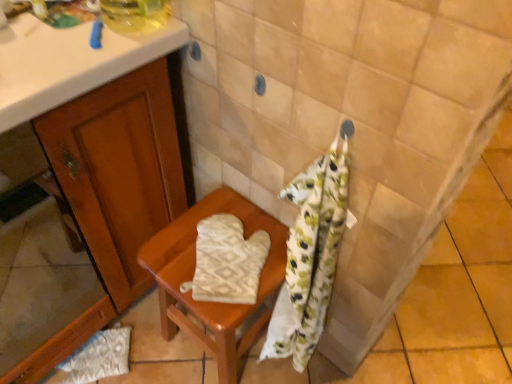
What do you see at coordinates (192, 276) in the screenshot?
I see `beige fabric oven mitt at center` at bounding box center [192, 276].

Locate an element on the screen. The width and height of the screenshot is (512, 384). white textured oven mitt at lower left is located at coordinates (99, 357).

The width and height of the screenshot is (512, 384). I want to click on beige textured oven mitt at center, so click(x=227, y=261).

The image size is (512, 384). What do you see at coordinates (227, 261) in the screenshot? I see `beige textured oven mitt at center` at bounding box center [227, 261].

Where is `beige fabric oven mitt at center`? beige fabric oven mitt at center is located at coordinates (192, 276).

Is white textured oven mitt at lower left not near beige textured oven mitt at center?

No, white textured oven mitt at lower left is in close proximity to beige textured oven mitt at center.

Is white textured oven mitt at lower left situated inside beige textured oven mitt at center or outside?

white textured oven mitt at lower left is spatially situated outside beige textured oven mitt at center.

Considering the sizes of white textured oven mitt at lower left and beige textured oven mitt at center in the image, is white textured oven mitt at lower left taller or shorter than beige textured oven mitt at center?

Considering their sizes, white textured oven mitt at lower left has less height than beige textured oven mitt at center.

Is beige textured oven mitt at center oriented towards beige fabric oven mitt at center?

No.

Does point (252, 289) come closer to viewer compared to point (197, 328)?

That is True.

From the picture: Is beige textured oven mitt at center outside of beige fabric oven mitt at center?

Absolutely, beige textured oven mitt at center is external to beige fabric oven mitt at center.

What's the angular difference between beige textured oven mitt at center and beige fabric oven mitt at center's facing directions?

The angular difference between beige textured oven mitt at center and beige fabric oven mitt at center is 42.2 degrees.

Based on the photo, does beige textured oven mitt at center have a lesser height compared to white textured oven mitt at lower left?

No.

Who is more distant, beige textured oven mitt at center or white textured oven mitt at lower left?

white textured oven mitt at lower left is more distant.

Considering the sizes of objects beige textured oven mitt at center and white textured oven mitt at lower left in the image provided, who is smaller, beige textured oven mitt at center or white textured oven mitt at lower left?

With smaller size is white textured oven mitt at lower left.

From a real-world perspective, is beige textured oven mitt at center beneath white textured oven mitt at lower left?

Incorrect, from a real-world perspective, beige textured oven mitt at center is higher than white textured oven mitt at lower left.

Is the surface of beige fabric oven mitt at center in direct contact with white textured oven mitt at lower left?

No, beige fabric oven mitt at center is not in contact with white textured oven mitt at lower left.

Would you say beige fabric oven mitt at center is outside white textured oven mitt at lower left?

beige fabric oven mitt at center lies outside white textured oven mitt at lower left's area.

From the image's perspective, relative to white textured oven mitt at lower left, is beige fabric oven mitt at center above or below?

From the image's perspective, beige fabric oven mitt at center appears above white textured oven mitt at lower left.

Considering the positions of point (180, 231) and point (94, 353), is point (180, 231) closer or farther from the camera than point (94, 353)?

Point (180, 231) is closer to the camera than point (94, 353).

In the scene shown: Which is behind, beige fabric oven mitt at center or beige textured oven mitt at center?

beige textured oven mitt at center is behind.

Can you tell me how much beige fabric oven mitt at center and beige textured oven mitt at center differ in facing direction?

There is a 42.2-degree angle between the facing directions of beige fabric oven mitt at center and beige textured oven mitt at center.

From a real-world perspective, which is physically below, beige fabric oven mitt at center or beige textured oven mitt at center?

beige fabric oven mitt at center is physically lower.

The height and width of the screenshot is (384, 512). I want to click on beach towel lying above the beige fabric oven mitt at center (from the image's perspective), so (227, 261).

Does white textured oven mitt at lower left have a greater width compared to beige fabric oven mitt at center?

No.

How many degrees apart are the facing directions of white textured oven mitt at lower left and beige fabric oven mitt at center?

The facing directions of white textured oven mitt at lower left and beige fabric oven mitt at center are 90.9 degrees apart.

Looking at this image, can you confirm if white textured oven mitt at lower left is shorter than beige fabric oven mitt at center?

Correct, white textured oven mitt at lower left is not as tall as beige fabric oven mitt at center.

Is white textured oven mitt at lower left next to beige fabric oven mitt at center and touching it?

No.

You are a GUI agent. You are given a task and a screenshot of the screen. Output one action in this format:
    pyautogui.click(x=<x>, y=<y>)
    Task: Click on the material located below the beige textured oven mitt at center (from the image's perspective)
    
    Given the screenshot: What is the action you would take?
    pyautogui.click(x=99, y=357)

Locate an element on the screen. The width and height of the screenshot is (512, 384). beach towel that appears behind the beige fabric oven mitt at center is located at coordinates (227, 261).

Looking at the image, which one is located further to white textured oven mitt at lower left, beige textured oven mitt at center or beige fabric oven mitt at center?

The object further to white textured oven mitt at lower left is beige textured oven mitt at center.

In the scene shown: When comparing their distances from beige fabric oven mitt at center, does beige textured oven mitt at center or white textured oven mitt at lower left seem further?

white textured oven mitt at lower left.

Looking at the image, which one is located closer to beige textured oven mitt at center, beige fabric oven mitt at center or white textured oven mitt at lower left?

Among the two, beige fabric oven mitt at center is located nearer to beige textured oven mitt at center.

Considering their positions, is beige fabric oven mitt at center positioned further to white textured oven mitt at lower left than beige textured oven mitt at center?

beige textured oven mitt at center is further to white textured oven mitt at lower left.

When comparing their distances from beige textured oven mitt at center, does white textured oven mitt at lower left or beige fabric oven mitt at center seem closer?

The object closer to beige textured oven mitt at center is beige fabric oven mitt at center.

Estimate the real-world distances between objects in this image. Which object is further from beige fabric oven mitt at center, white textured oven mitt at lower left or beige textured oven mitt at center?

white textured oven mitt at lower left is further to beige fabric oven mitt at center.

The height and width of the screenshot is (384, 512). What are the coordinates of `furniture located between white textured oven mitt at lower left and beige textured oven mitt at center in the left-right direction` in the screenshot? It's located at (192, 276).